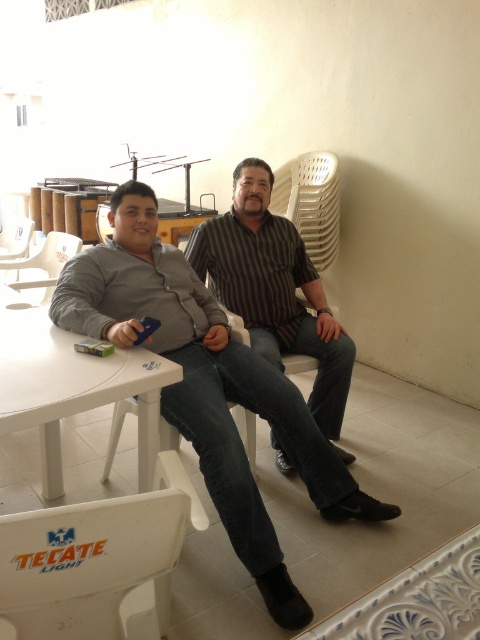
Which is more to the right, gray cotton shirt at center or white plastic chair at lower left?

gray cotton shirt at center is more to the right.

Which is below, gray cotton shirt at center or white plastic chair at lower left?

white plastic chair at lower left is below.

Is point (160, 284) behind point (175, 516)?

Yes, point (160, 284) is behind point (175, 516).

Find the location of `gray cotton shirt at center`. gray cotton shirt at center is located at coordinates (207, 387).

Is gray cotton shirt at center bigger than brown striped shirt at center?

Yes, gray cotton shirt at center is bigger than brown striped shirt at center.

Does point (62, 317) lie behind point (199, 253)?

No, (62, 317) is in front of (199, 253).

Does point (331, 500) lie in front of point (288, 284)?

Yes, it is in front of point (288, 284).

You are a GUI agent. You are given a task and a screenshot of the screen. Output one action in this format:
    pyautogui.click(x=<x>, y=<y>)
    Task: Click on the gray cotton shirt at center
    Image resolution: width=480 pixels, height=640 pixels.
    Given the screenshot: What is the action you would take?
    pyautogui.click(x=207, y=387)

Who is more forward, (205, 252) or (20, 317)?

Point (20, 317) is in front.

Locate an element on the screen. The height and width of the screenshot is (640, 480). brown striped shirt at center is located at coordinates [x=275, y=291].

I want to click on brown striped shirt at center, so click(275, 291).